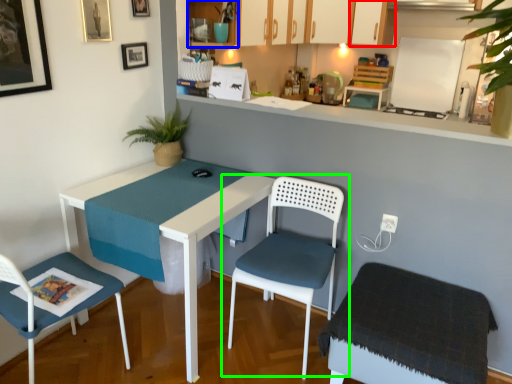
Question: Which object is the farthest from cabinetry (highlighted by a red box)? Choose among these: cabinetry (highlighted by a blue box) or chair (highlighted by a green box).

Choices:
 (A) cabinetry
 (B) chair

Answer: (B)